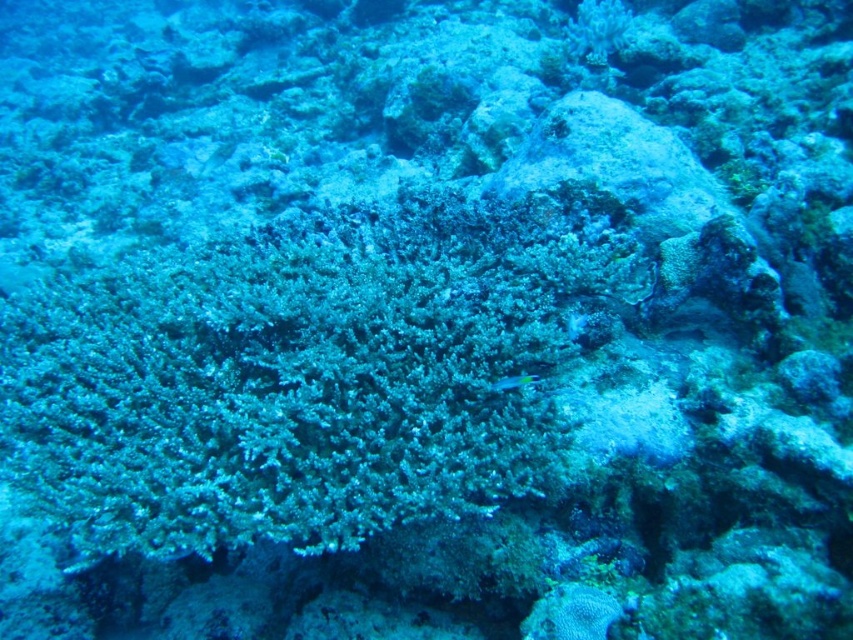
Question: Considering the relative positions of green matte coral at center and shiny blue fish at center in the image provided, where is green matte coral at center located with respect to shiny blue fish at center?

Choices:
 (A) below
 (B) above

Answer: (B)

Question: Can you confirm if green matte coral at center is thinner than shiny blue fish at center?

Choices:
 (A) no
 (B) yes

Answer: (A)

Question: Which object is farther from the camera taking this photo?

Choices:
 (A) shiny blue fish at center
 (B) green matte coral at center

Answer: (A)

Question: Which point is closer to the camera taking this photo?

Choices:
 (A) (461, 404)
 (B) (527, 384)

Answer: (B)

Question: Does green matte coral at center appear on the left side of shiny blue fish at center?

Choices:
 (A) no
 (B) yes

Answer: (B)